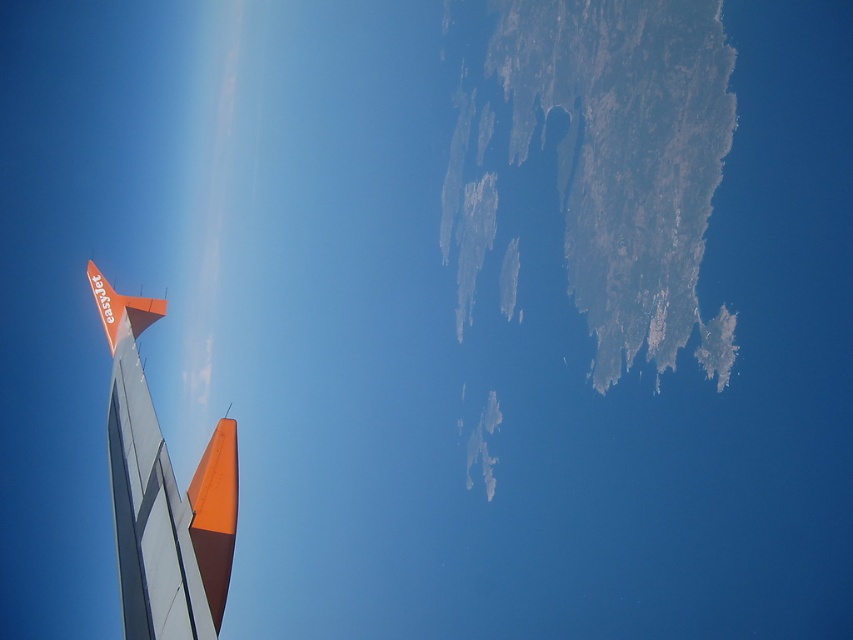
You are a flight attendant observing the view from the airplane window. You notice the orange matte airplane wing at left and the orange matte airplane tail at upper left. Which object has a greater width?

The orange matte airplane wing at left has a greater width than the orange matte airplane tail at upper left.

You are a pilot looking at the airplane wing from the cockpit. The control panel shows coordinates for the wing. Where is the orange matte airplane wing at left located in 2D coordinates?

The orange matte airplane wing at left is located at 2D coordinates point (161, 493).